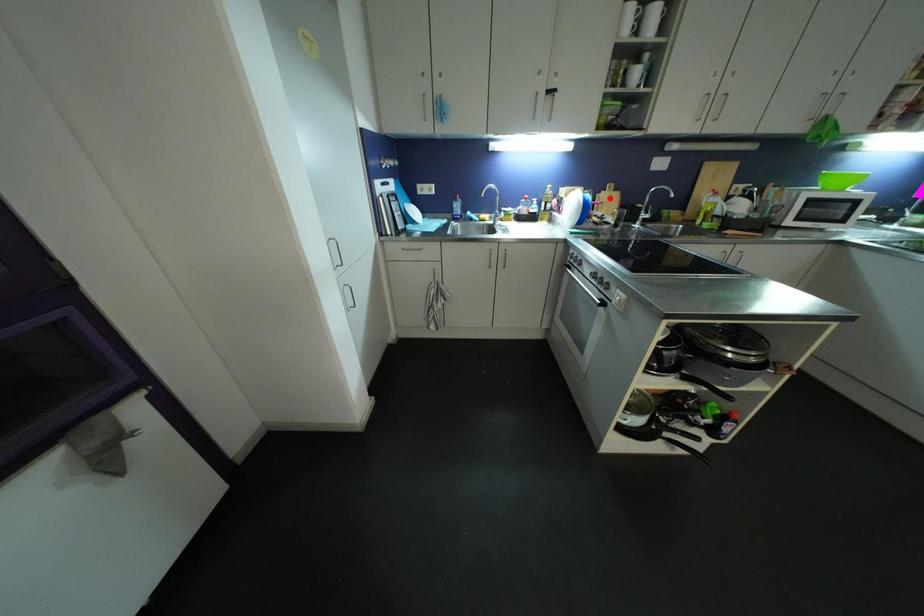
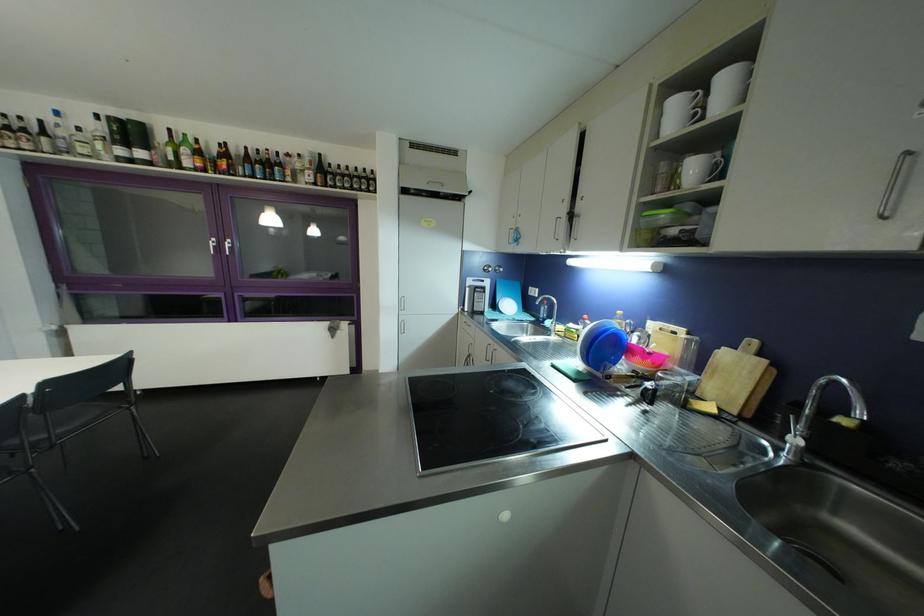
Locate, in the second image, the point that corresponds to the highlighted location in the first image.

(732, 358)